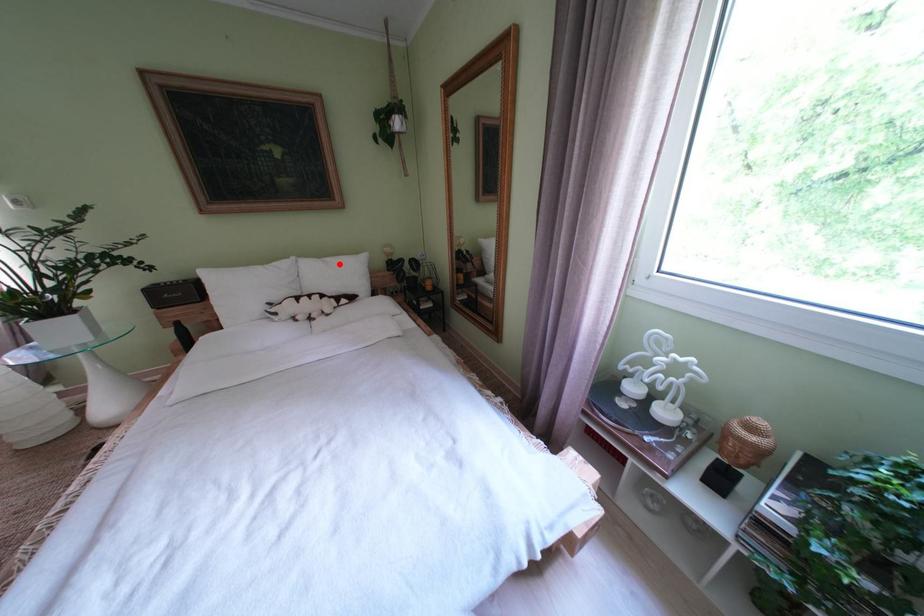
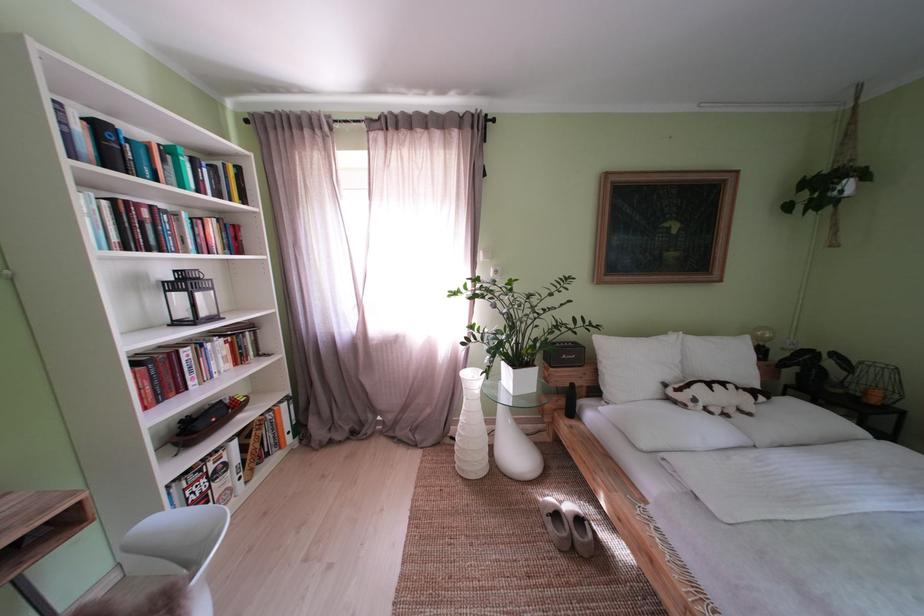
Find the pixel in the second image that matches the highlighted location in the first image.

(723, 344)